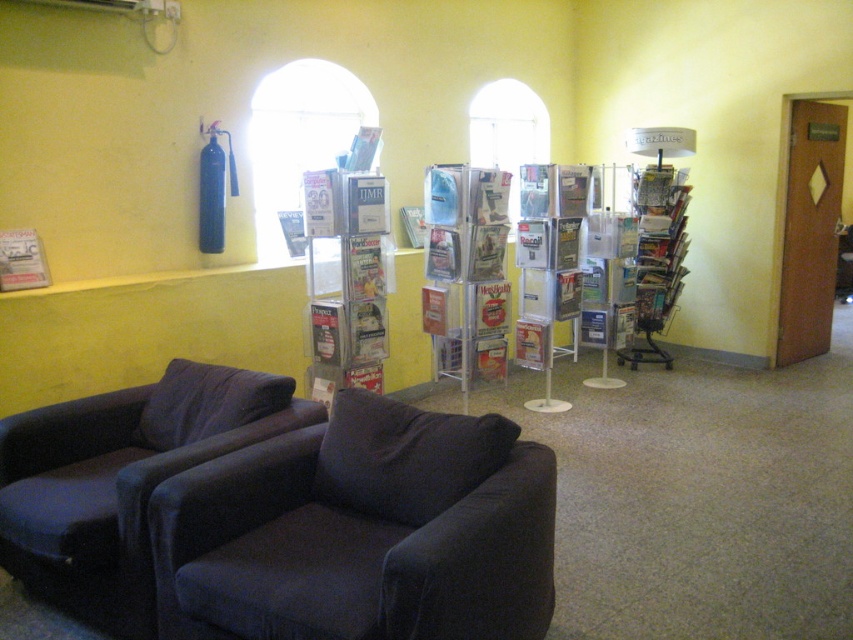
Does dark blue fabric armchair at lower left lie behind metallic silver magazine rack at center-right?

No, dark blue fabric armchair at lower left is closer to the viewer.

Does point (335, 460) come farther from viewer compared to point (646, 275)?

No, it is in front of (646, 275).

Is point (190, 547) positioned before point (641, 269)?

Yes, point (190, 547) is in front of point (641, 269).

The height and width of the screenshot is (640, 853). I want to click on dark blue fabric armchair at lower left, so click(361, 531).

Is dark blue fabric couch at lower left to the left of metallic silver magazine rack at center-right from the viewer's perspective?

Indeed, dark blue fabric couch at lower left is positioned on the left side of metallic silver magazine rack at center-right.

Does dark blue fabric couch at lower left have a larger size compared to metallic silver magazine rack at center-right?

Indeed, dark blue fabric couch at lower left has a larger size compared to metallic silver magazine rack at center-right.

Find the location of a particular element. The image size is (853, 640). dark blue fabric couch at lower left is located at coordinates (120, 480).

Who is more forward, (489, 440) or (36, 248)?

Point (489, 440) is in front.

Based on the photo, between dark blue fabric armchair at lower left and matte paper magazine at left, which one is positioned higher?

matte paper magazine at left

The width and height of the screenshot is (853, 640). Describe the element at coordinates (361, 531) in the screenshot. I see `dark blue fabric armchair at lower left` at that location.

Where is `dark blue fabric armchair at lower left`? dark blue fabric armchair at lower left is located at coordinates (361, 531).